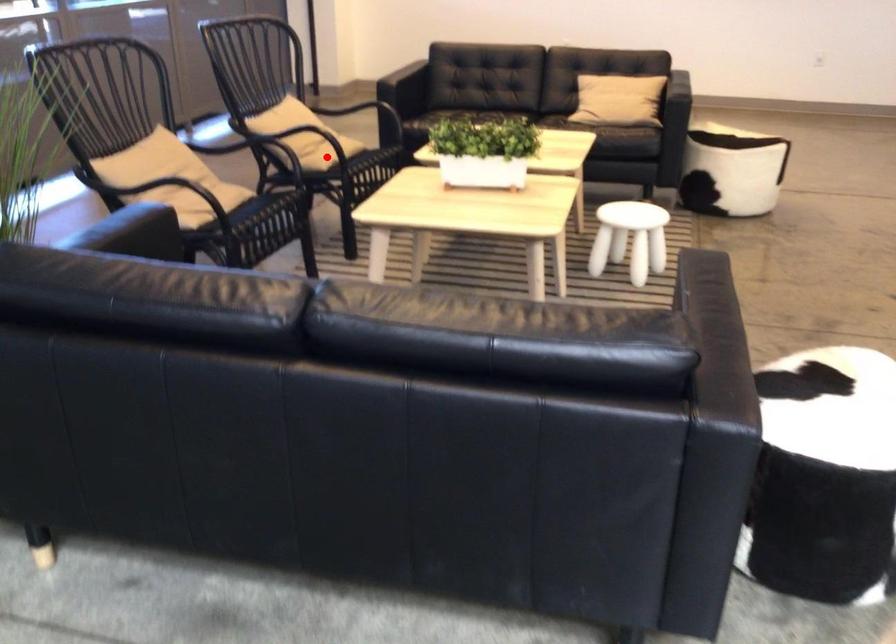
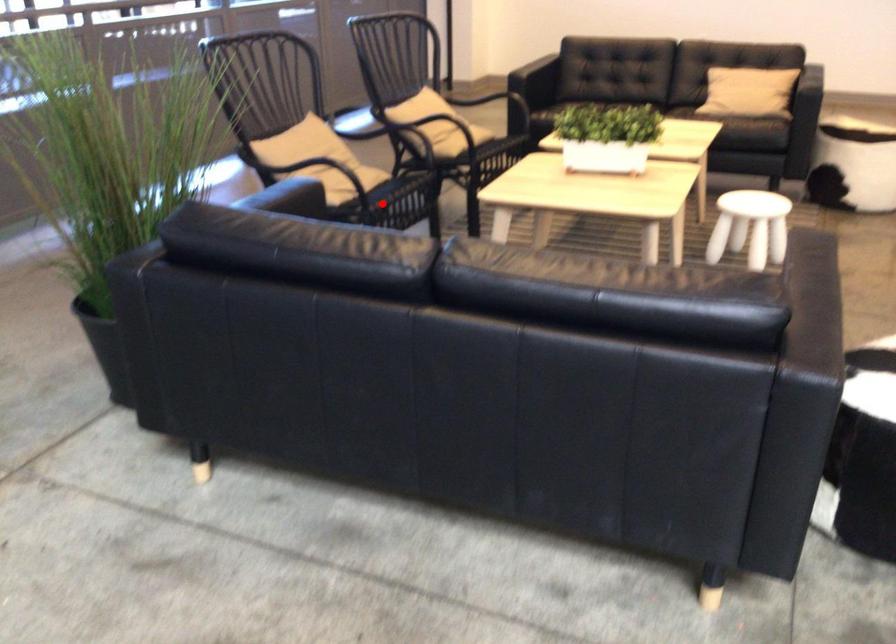
I am providing you with two images of the same scene from different viewpoints. A red point is marked on the first image and another point is marked on the second image. Are the points marked in image1 and image2 representing the same 3D position?

No